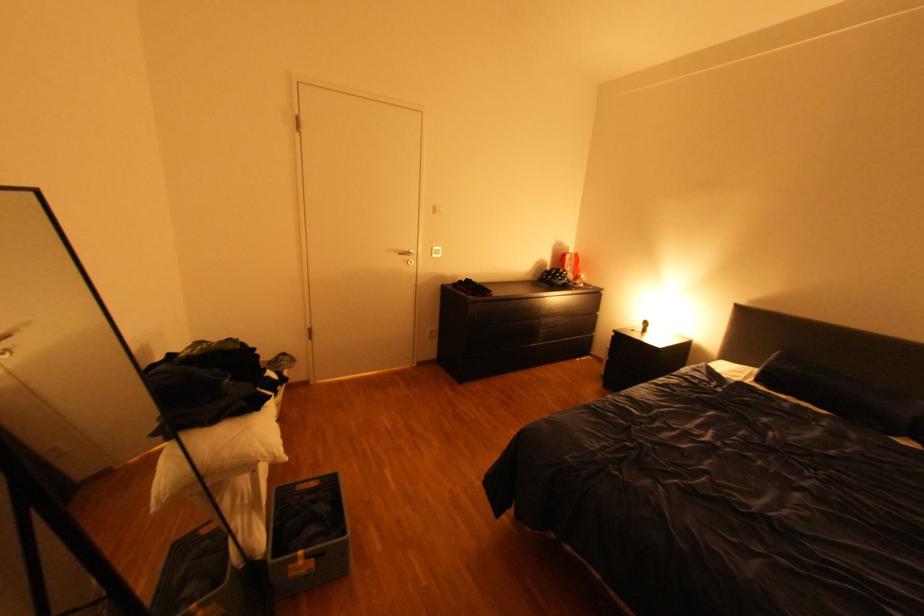
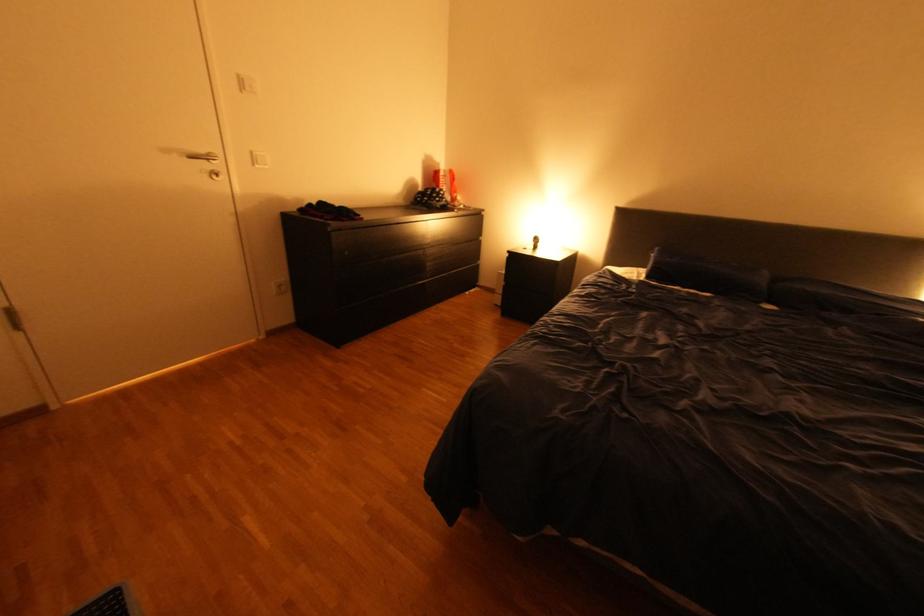
The point at (756, 378) is marked in the first image. Where is the corresponding point in the second image?

(648, 277)